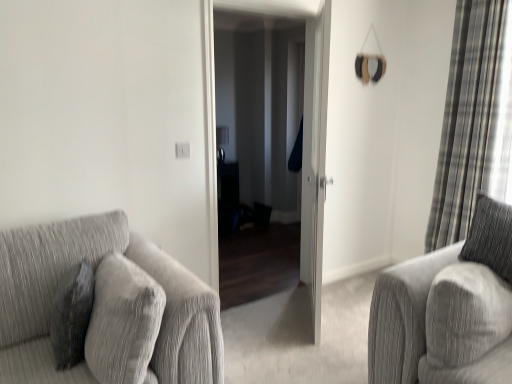
Question: From a real-world perspective, is matte black screen door at center, the second screen door viewed from the right, physically above white glossy door at center, placed as the first screen door when sorted from right to left?

Choices:
 (A) yes
 (B) no

Answer: (A)

Question: Does matte black screen door at center, the second screen door viewed from the right, have a greater width compared to white glossy door at center, placed as the second screen door when sorted from left to right?

Choices:
 (A) no
 (B) yes

Answer: (B)

Question: Is matte black screen door at center, the second screen door viewed from the right, positioned beyond the bounds of white glossy door at center, placed as the first screen door when sorted from right to left?

Choices:
 (A) no
 (B) yes

Answer: (B)

Question: Can you confirm if matte black screen door at center, the second screen door viewed from the right, is thinner than white glossy door at center, placed as the second screen door when sorted from left to right?

Choices:
 (A) yes
 (B) no

Answer: (B)

Question: Is matte black screen door at center, arranged as the 1th screen door when viewed from the left, placed right next to white glossy door at center, placed as the first screen door when sorted from right to left?

Choices:
 (A) no
 (B) yes

Answer: (A)

Question: Does matte black screen door at center, the second screen door viewed from the right, turn towards white glossy door at center, placed as the first screen door when sorted from right to left?

Choices:
 (A) no
 (B) yes

Answer: (B)

Question: Is velvet dark gray pillow at left at the back of matte black screen door at center, arranged as the 1th screen door when viewed from the left?

Choices:
 (A) yes
 (B) no

Answer: (B)

Question: Considering the relative sizes of matte black screen door at center, the second screen door viewed from the right, and velvet dark gray pillow at left in the image provided, is matte black screen door at center, the second screen door viewed from the right, smaller than velvet dark gray pillow at left?

Choices:
 (A) yes
 (B) no

Answer: (B)

Question: Considering the relative sizes of matte black screen door at center, arranged as the 1th screen door when viewed from the left, and velvet dark gray pillow at left in the image provided, is matte black screen door at center, arranged as the 1th screen door when viewed from the left, wider than velvet dark gray pillow at left?

Choices:
 (A) yes
 (B) no

Answer: (A)

Question: Is matte black screen door at center, the second screen door viewed from the right, completely or partially outside of velvet dark gray pillow at left?

Choices:
 (A) yes
 (B) no

Answer: (A)

Question: Does matte black screen door at center, arranged as the 1th screen door when viewed from the left, lie behind velvet dark gray pillow at left?

Choices:
 (A) yes
 (B) no

Answer: (A)

Question: Is matte black screen door at center, arranged as the 1th screen door when viewed from the left, surrounding velvet dark gray pillow at left?

Choices:
 (A) yes
 (B) no

Answer: (B)

Question: Is the depth of white glossy door at center, placed as the first screen door when sorted from right to left, greater than that of textured gray couch at left?

Choices:
 (A) no
 (B) yes

Answer: (B)